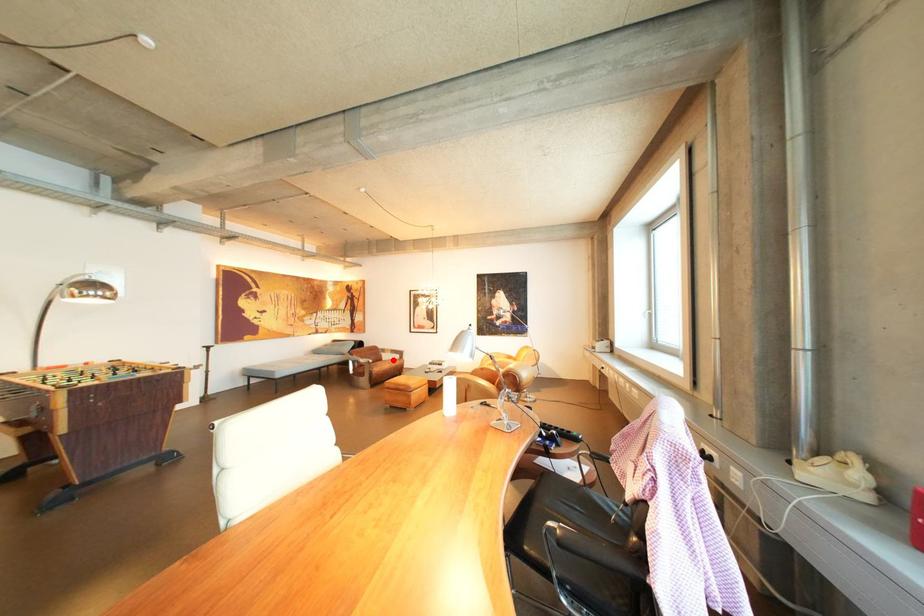
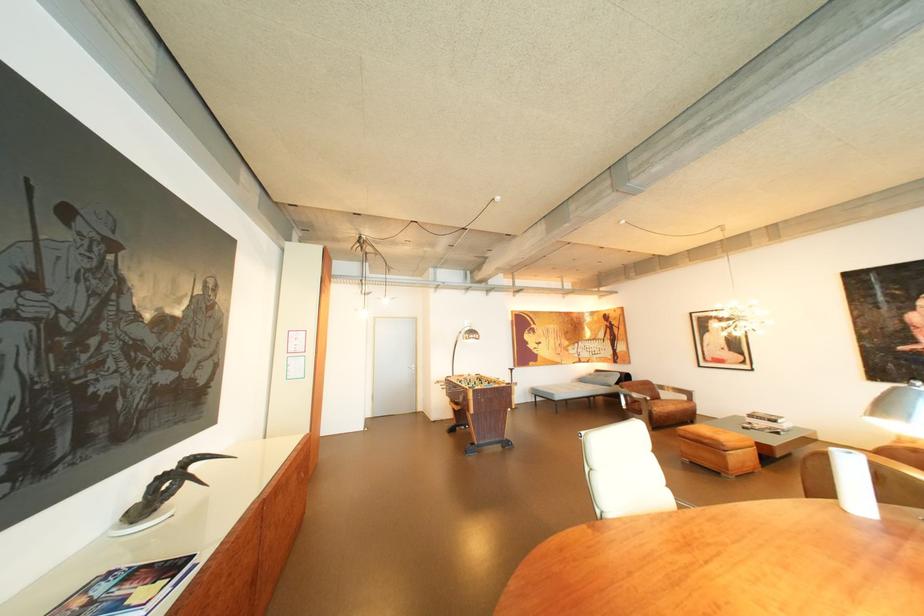
In the second image, find the point that corresponds to the highlighted location in the first image.

(671, 399)